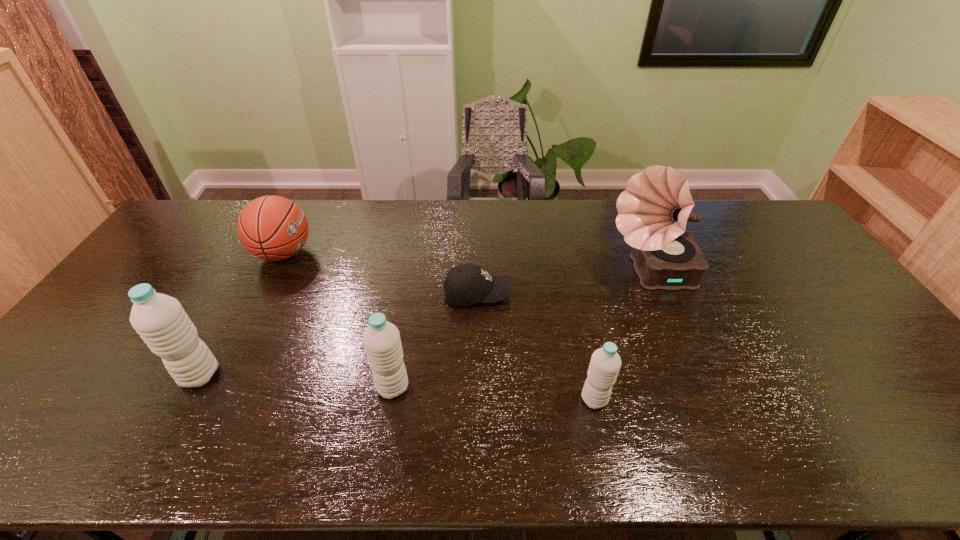
Find the location of a particular element. The height and width of the screenshot is (540, 960). free point between the baseball cap and the leftmost water bottle is located at coordinates (339, 334).

This screenshot has height=540, width=960. I want to click on unoccupied position between the rightmost object and the baseball cap, so click(564, 284).

Locate an element on the screen. The width and height of the screenshot is (960, 540). free space between the second object from right to left and the basketball is located at coordinates (439, 326).

Identify the location of vacant area that lies between the rightmost object and the second tallest water bottle. (521, 330).

The image size is (960, 540). Identify the location of vacant area between the rightmost water bottle and the shortest object. (536, 347).

Choose which object is the second nearest neighbor to the fifth object from left to right. Please provide its 2D coordinates. Your answer should be formatted as a tuple, i.e. [(x, y)], where the tuple contains the x and y coordinates of a point satisfying the conditions above.

[(467, 284)]

Select which object is the closest to the third object from left to right. Please provide its 2D coordinates. Your answer should be formatted as a tuple, i.e. [(x, y)], where the tuple contains the x and y coordinates of a point satisfying the conditions above.

[(467, 284)]

Where is `water bottle that is the second closest to the second shortest water bottle`? This screenshot has height=540, width=960. water bottle that is the second closest to the second shortest water bottle is located at coordinates (605, 363).

At what (x,y) coordinates should I click in order to perform the action: click on the second closest water bottle to the record player. Please return your answer as a coordinate pair (x, y). The height and width of the screenshot is (540, 960). Looking at the image, I should click on (381, 339).

This screenshot has height=540, width=960. I want to click on vacant space that satisfies the following two spatial constraints: 1. on the logo side of the shortest water bottle; 2. on the left side of the basketball, so click(x=209, y=399).